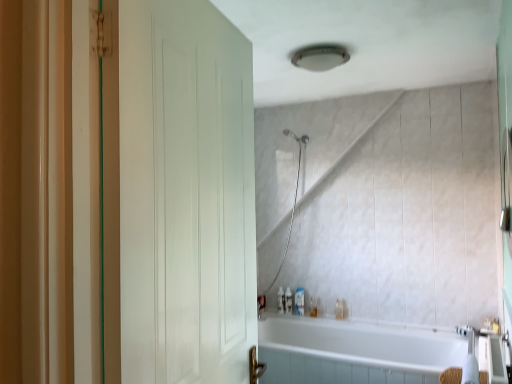
At what (x,y) coordinates should I click in order to perform the action: click on vacant space situated on the left part of translucent plastic soap dispenser at lower center, placed as the fifth toiletry when sorted from right to left. Please return your answer as a coordinate pair (x, y). Looking at the image, I should click on (269, 311).